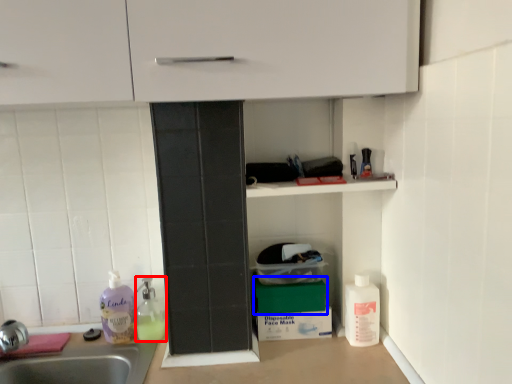
Question: Which object appears farthest to the camera in this image, cleaning product (highlighted by a red box) or box (highlighted by a blue box)?

Choices:
 (A) cleaning product
 (B) box

Answer: (A)